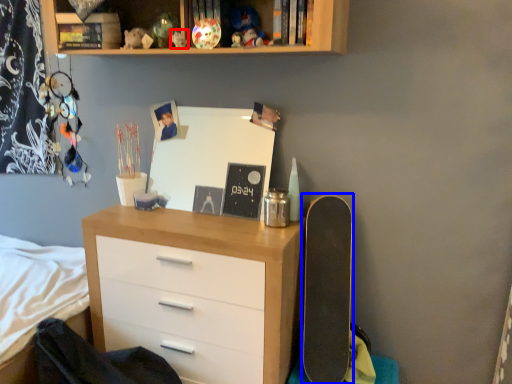
Question: Among these objects, which one is nearest to the camera, toy (highlighted by a red box) or skateboard (highlighted by a blue box)?

Choices:
 (A) toy
 (B) skateboard

Answer: (B)